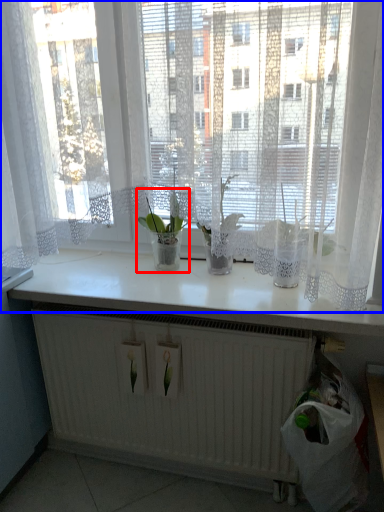
Question: Which object appears farthest to the camera in this image, houseplant (highlighted by a red box) or curtain (highlighted by a blue box)?

Choices:
 (A) houseplant
 (B) curtain

Answer: (A)